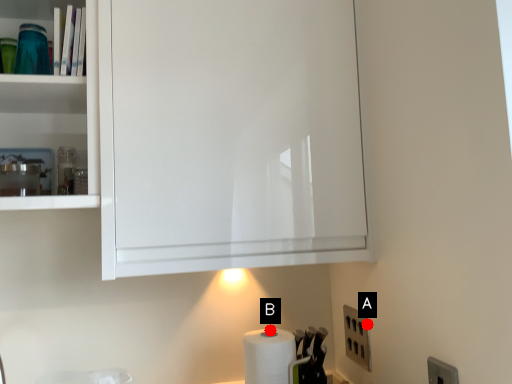
Question: Two points are circled on the image, labeled by A and B beside each circle. Which of the following is the farthest from the observer?

Choices:
 (A) A is further
 (B) B is further

Answer: (B)